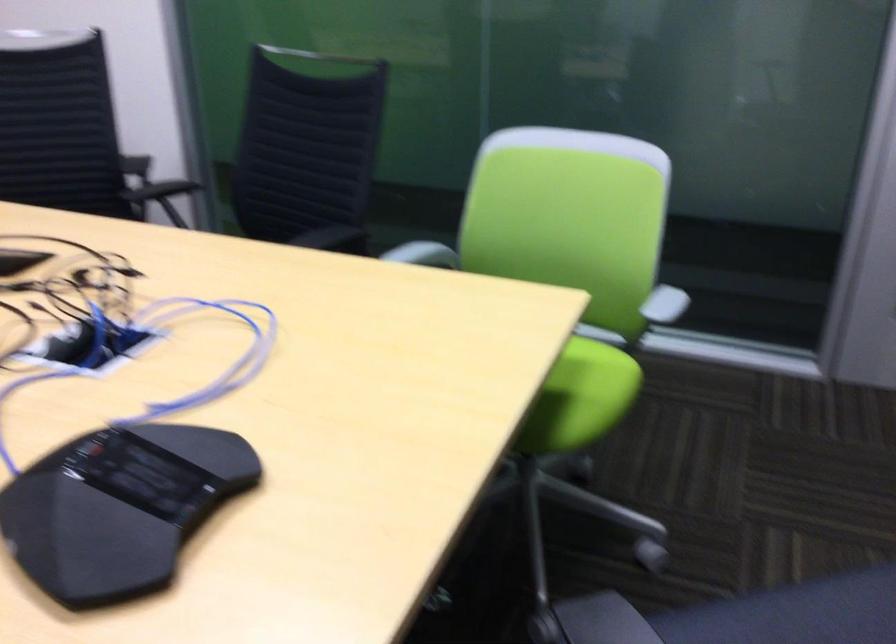
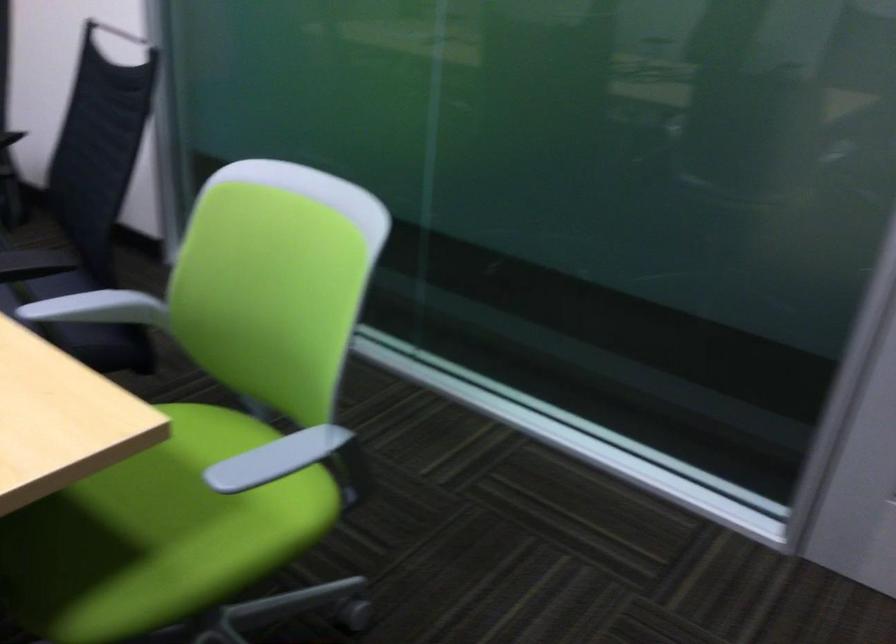
What movement of the cameraman would produce the second image?

The cameraman moved toward right, forward.